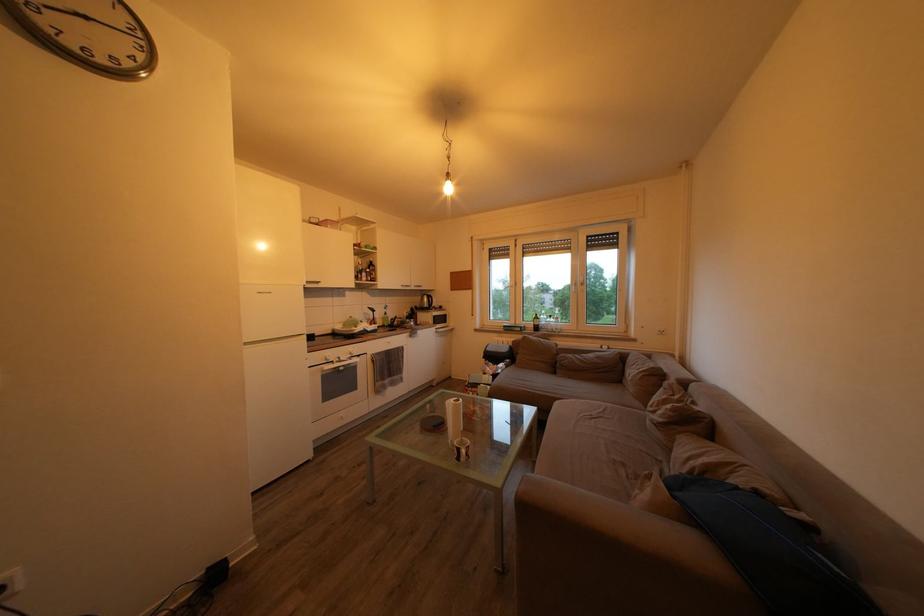
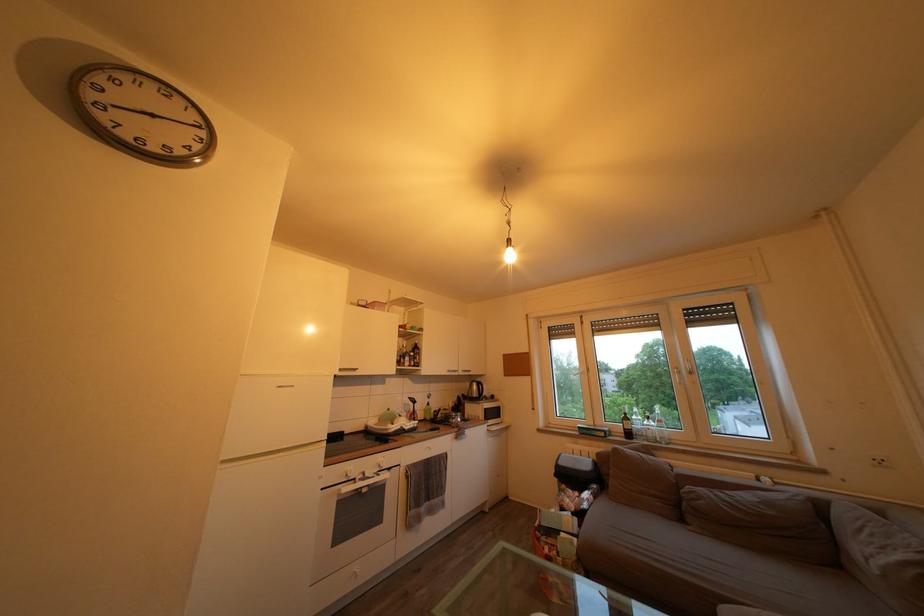
Locate, in the second image, the point that corresponds to pixel 134 69 in the first image.

(188, 158)